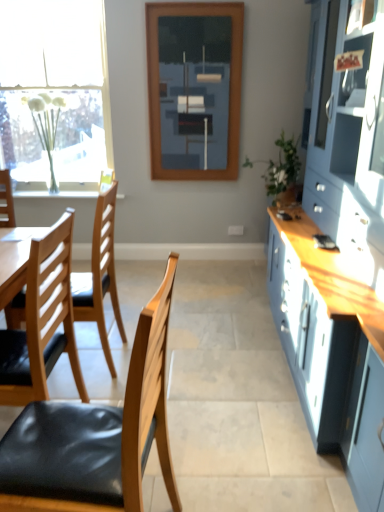
The height and width of the screenshot is (512, 384). What do you see at coordinates (100, 276) in the screenshot? I see `wooden chair with black seat cushion at left, the first chair positioned from the back` at bounding box center [100, 276].

Locate an element on the screen. This screenshot has height=512, width=384. wooden chair with black seat cushion at left, the first chair positioned from the back is located at coordinates (100, 276).

In order to click on black glossy mobile phone at right in this screenshot , I will do `click(324, 242)`.

Find the location of a particular element. This screenshot has width=384, height=512. black leather chair at left, the 2th chair when ordered from back to front is located at coordinates (96, 435).

Locate an element on the screen. The width and height of the screenshot is (384, 512). matte blue cabinet at right is located at coordinates (339, 254).

What do you see at coordinates (79, 138) in the screenshot? I see `white frosted glass vase at left` at bounding box center [79, 138].

What is the approximate width of green leafy plant at right?

It is 52.99 centimeters.

Image resolution: width=384 pixels, height=512 pixels. Find the location of `wooden frame at center`. wooden frame at center is located at coordinates (194, 89).

Measure the distance between white sheer curtain at left and camera.

white sheer curtain at left is 3.78 meters from camera.

This screenshot has width=384, height=512. Identify the location of wooden chair with black seat cushion at left, the first chair positioned from the back. (100, 276).

Can you confirm if white sheer curtain at left is positioned to the left of wooden frame at center?

Correct, you'll find white sheer curtain at left to the left of wooden frame at center.

Identify the location of window frame on the right of white sheer curtain at left. The image size is (384, 512). (194, 89).

Which object is wider, white sheer curtain at left or wooden frame at center?

Wider between the two is white sheer curtain at left.

Does matte blue cabinet at right appear on the left side of white sheer curtain at left?

In fact, matte blue cabinet at right is to the right of white sheer curtain at left.

Is matte blue cabinet at right completely or partially outside of white sheer curtain at left?

matte blue cabinet at right lies outside white sheer curtain at left's area.

Can you tell me how much matte blue cabinet at right and white sheer curtain at left differ in facing direction?

The angle between the facing direction of matte blue cabinet at right and the facing direction of white sheer curtain at left is 91.5 degrees.

From the image's perspective, is matte blue cabinet at right on top of white sheer curtain at left?

No, from the image's perspective, matte blue cabinet at right is not on top of white sheer curtain at left.

Which of these two, white frosted glass vase at left or black leather chair at left, the 2th chair when ordered from back to front, is smaller?

Smaller between the two is white frosted glass vase at left.

How different are the orientations of white frosted glass vase at left and black leather chair at left, the 2th chair when ordered from back to front, in degrees?

There is a 94-degree angle between the facing directions of white frosted glass vase at left and black leather chair at left, the 2th chair when ordered from back to front.

Consider the image. Considering the positions of objects white frosted glass vase at left and black leather chair at left, the 2th chair when ordered from back to front, in the image provided, who is in front, white frosted glass vase at left or black leather chair at left, the 2th chair when ordered from back to front,?

Positioned in front is black leather chair at left, the 2th chair when ordered from back to front.

Which object is more forward, white sheer curtain at left or matte blue cabinet at right?

matte blue cabinet at right.

Is white sheer curtain at left aimed at matte blue cabinet at right?

No.

From a real-world perspective, is white sheer curtain at left physically located above or below matte blue cabinet at right?

From a real-world perspective, white sheer curtain at left is physically above matte blue cabinet at right.

Can you see green leafy plant at right touching wooden chair with black seat cushion at left, which appears as the 2th chair when viewed from the front?

green leafy plant at right is not next to wooden chair with black seat cushion at left, which appears as the 2th chair when viewed from the front, and they're not touching.

Locate an element on the screen. The height and width of the screenshot is (512, 384). houseplant located above the wooden chair with black seat cushion at left, which appears as the 2th chair when viewed from the front (from a real-world perspective) is located at coordinates (281, 170).

In the scene shown: Can you confirm if green leafy plant at right is shorter than wooden chair with black seat cushion at left, which appears as the 2th chair when viewed from the front?

Indeed, green leafy plant at right has a lesser height compared to wooden chair with black seat cushion at left, which appears as the 2th chair when viewed from the front.

Is black glossy mobile phone at right at the back of wooden frame at center?

No, wooden frame at center is not facing away from black glossy mobile phone at right.

Does wooden frame at center have a lesser height compared to black glossy mobile phone at right?

No.

What are the coordinates of `window frame to the left of black glossy mobile phone at right` in the screenshot? It's located at (194, 89).

Considering the positions of objects wooden frame at center and black glossy mobile phone at right in the image provided, who is more to the right, wooden frame at center or black glossy mobile phone at right?

black glossy mobile phone at right is more to the right.

Find the location of `mobile phone on the left of matte blue cabinet at right`. mobile phone on the left of matte blue cabinet at right is located at coordinates (324, 242).

Based on their positions, is matte blue cabinet at right located to the left or right of black glossy mobile phone at right?

Clearly, matte blue cabinet at right is on the right of black glossy mobile phone at right in the image.

Is matte blue cabinet at right aimed at black glossy mobile phone at right?

Yes, matte blue cabinet at right is facing black glossy mobile phone at right.

From the image's perspective, who appears lower, matte blue cabinet at right or black glossy mobile phone at right?

black glossy mobile phone at right appears lower in the image.

Where is `window frame located on the right of white sheer curtain at left`? The width and height of the screenshot is (384, 512). window frame located on the right of white sheer curtain at left is located at coordinates (194, 89).

The width and height of the screenshot is (384, 512). I want to click on cabinetry below the white sheer curtain at left (from the image's perspective), so click(x=339, y=254).

Which object lies nearer to the anchor point black glossy mobile phone at right, white frosted glass vase at left or wooden chair with black seat cushion at left, which appears as the 2th chair when viewed from the front?

wooden chair with black seat cushion at left, which appears as the 2th chair when viewed from the front.

Considering their positions, is matte blue cabinet at right positioned further to wooden frame at center than black leather chair at left, the 2th chair when ordered from back to front?

black leather chair at left, the 2th chair when ordered from back to front, is further to wooden frame at center.

Which object lies nearer to the anchor point wooden frame at center, black leather chair at left, the 2th chair when ordered from back to front, or wooden chair with black seat cushion at left, the first chair positioned from the back?

wooden chair with black seat cushion at left, the first chair positioned from the back, is closer to wooden frame at center.

Consider the image. Looking at the image, which one is located closer to white frosted glass vase at left, wooden frame at center or white sheer curtain at left?

white sheer curtain at left is positioned closer to the anchor white frosted glass vase at left.

Based on their spatial positions, is matte blue cabinet at right or white frosted glass vase at left further from green leafy plant at right?

white frosted glass vase at left lies further to green leafy plant at right than the other object.

Consider the image. Estimate the real-world distances between objects in this image. Which object is closer to green leafy plant at right, wooden chair with black seat cushion at left, which appears as the 2th chair when viewed from the front, or black leather chair at left, the first chair when ordered from front to back?

wooden chair with black seat cushion at left, which appears as the 2th chair when viewed from the front, lies closer to green leafy plant at right than the other object.

When comparing their distances from wooden frame at center, does green leafy plant at right or matte blue cabinet at right seem further?

Among the two, matte blue cabinet at right is located further to wooden frame at center.

Estimate the real-world distances between objects in this image. Which object is closer to wooden frame at center, black glossy mobile phone at right or white sheer curtain at left?

white sheer curtain at left is positioned closer to the anchor wooden frame at center.

The height and width of the screenshot is (512, 384). I want to click on window frame between white sheer curtain at left and black glossy mobile phone at right, so click(194, 89).

The width and height of the screenshot is (384, 512). I want to click on window situated between white frosted glass vase at left and black glossy mobile phone at right from left to right, so click(x=54, y=93).

The height and width of the screenshot is (512, 384). In order to click on houseplant between black leather chair at left, the first chair when ordered from front to back, and white frosted glass vase at left from front to back in this screenshot , I will do `click(281, 170)`.

Locate an element on the screen. window frame between white frosted glass vase at left and black glossy mobile phone at right is located at coordinates (194, 89).